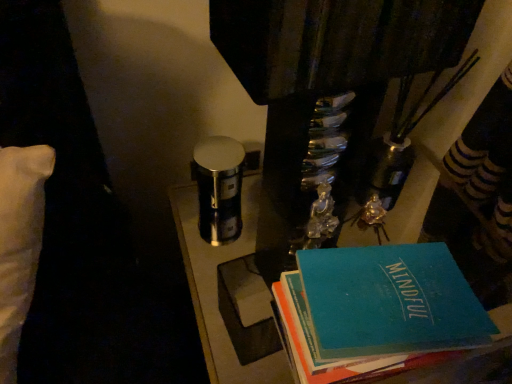
Question: Can you confirm if metallic/reflective table at center is wider than teal matte book at lower right?

Choices:
 (A) no
 (B) yes

Answer: (B)

Question: From the image's perspective, would you say metallic/reflective table at center is positioned over teal matte book at lower right?

Choices:
 (A) no
 (B) yes

Answer: (A)

Question: From a real-world perspective, is metallic/reflective table at center located higher than teal matte book at lower right?

Choices:
 (A) no
 (B) yes

Answer: (A)

Question: Does metallic/reflective table at center have a lesser width compared to teal matte book at lower right?

Choices:
 (A) yes
 (B) no

Answer: (B)

Question: Considering the relative sizes of metallic/reflective table at center and teal matte book at lower right in the image provided, is metallic/reflective table at center shorter than teal matte book at lower right?

Choices:
 (A) no
 (B) yes

Answer: (A)

Question: Does metallic/reflective table at center appear on the left side of teal matte book at lower right?

Choices:
 (A) yes
 (B) no

Answer: (A)

Question: Is teal matte book at lower right bigger than metallic/reflective table at center?

Choices:
 (A) no
 (B) yes

Answer: (A)

Question: From the image's perspective, is teal matte book at lower right beneath metallic/reflective table at center?

Choices:
 (A) yes
 (B) no

Answer: (B)

Question: From a real-world perspective, does teal matte book at lower right stand above metallic/reflective table at center?

Choices:
 (A) no
 (B) yes

Answer: (B)

Question: Is teal matte book at lower right at the left side of metallic/reflective table at center?

Choices:
 (A) no
 (B) yes

Answer: (A)

Question: Is teal matte book at lower right outside metallic/reflective table at center?

Choices:
 (A) yes
 (B) no

Answer: (A)

Question: Is teal matte book at lower right positioned before metallic/reflective table at center?

Choices:
 (A) yes
 (B) no

Answer: (A)

Question: From the image's perspective, is teal matte book at lower right above or below metallic/reflective table at center?

Choices:
 (A) below
 (B) above

Answer: (B)